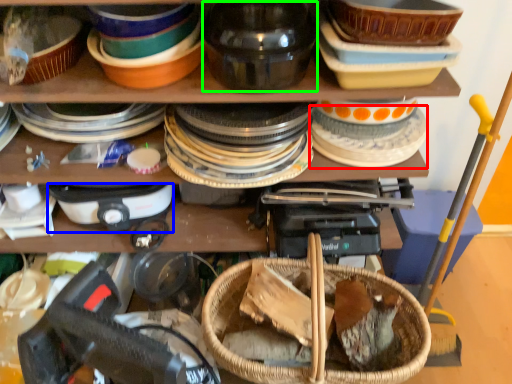
Question: Which object is the farthest from tableware (highlighted by a red box)? Choose among these: appliance (highlighted by a blue box) or tableware (highlighted by a green box).

Choices:
 (A) appliance
 (B) tableware

Answer: (A)